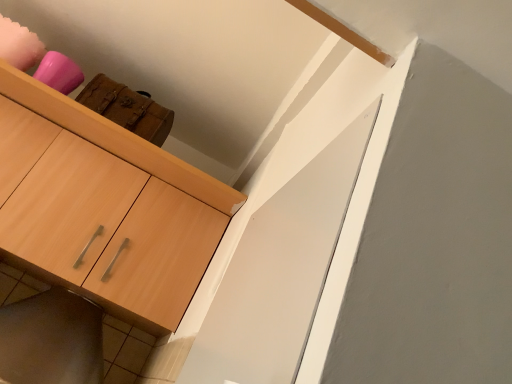
Question: Could you tell me if wooden cabinet at lower left is facing light wood cabinet at upper left?

Choices:
 (A) no
 (B) yes

Answer: (B)

Question: Is wooden cabinet at lower left beside light wood cabinet at upper left?

Choices:
 (A) no
 (B) yes

Answer: (A)

Question: Is wooden cabinet at lower left turned away from light wood cabinet at upper left?

Choices:
 (A) no
 (B) yes

Answer: (B)

Question: From a real-world perspective, is wooden cabinet at lower left physically below light wood cabinet at upper left?

Choices:
 (A) yes
 (B) no

Answer: (A)

Question: Is wooden cabinet at lower left closer to camera compared to light wood cabinet at upper left?

Choices:
 (A) yes
 (B) no

Answer: (B)

Question: Can you confirm if wooden cabinet at lower left is shorter than light wood cabinet at upper left?

Choices:
 (A) yes
 (B) no

Answer: (A)

Question: Is light wood cabinet at upper left facing towards wooden cabinet at lower left?

Choices:
 (A) yes
 (B) no

Answer: (A)

Question: Is light wood cabinet at upper left at the left side of wooden cabinet at lower left?

Choices:
 (A) yes
 (B) no

Answer: (A)

Question: Is light wood cabinet at upper left behind wooden cabinet at lower left?

Choices:
 (A) no
 (B) yes

Answer: (A)

Question: From the image's perspective, is light wood cabinet at upper left on wooden cabinet at lower left?

Choices:
 (A) no
 (B) yes

Answer: (B)

Question: Considering the relative sizes of light wood cabinet at upper left and wooden cabinet at lower left in the image provided, is light wood cabinet at upper left thinner than wooden cabinet at lower left?

Choices:
 (A) yes
 (B) no

Answer: (B)

Question: Is light wood cabinet at upper left positioned before wooden cabinet at lower left?

Choices:
 (A) no
 (B) yes

Answer: (B)

Question: From a real-world perspective, is light wood cabinet at upper left positioned above or below wooden cabinet at lower left?

Choices:
 (A) below
 (B) above

Answer: (B)